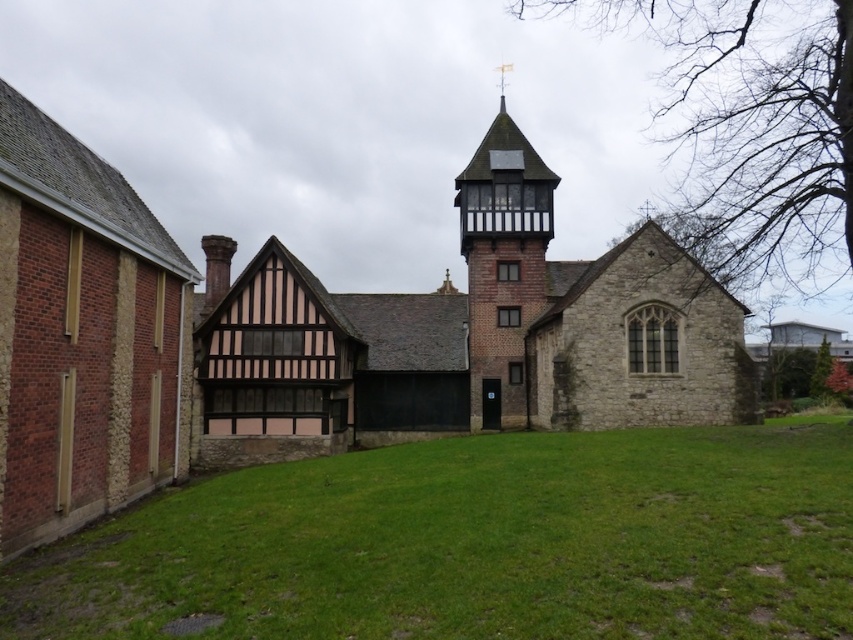
Question: Which object appears farthest from the camera in this image?

Choices:
 (A) green grass at center
 (B) stone church at center

Answer: (B)

Question: Is stone church at center in front of green grass at center?

Choices:
 (A) yes
 (B) no

Answer: (B)

Question: Does green grass at center have a lesser width compared to brick stonework bell tower at center?

Choices:
 (A) yes
 (B) no

Answer: (B)

Question: Which point is closer to the camera taking this photo?

Choices:
 (A) (45, 616)
 (B) (357, 372)

Answer: (A)

Question: Which of these objects is positioned closest to the stone church at center?

Choices:
 (A) green grass at center
 (B) brick stonework bell tower at center

Answer: (B)

Question: Does stone church at center lie behind brick stonework bell tower at center?

Choices:
 (A) yes
 (B) no

Answer: (B)